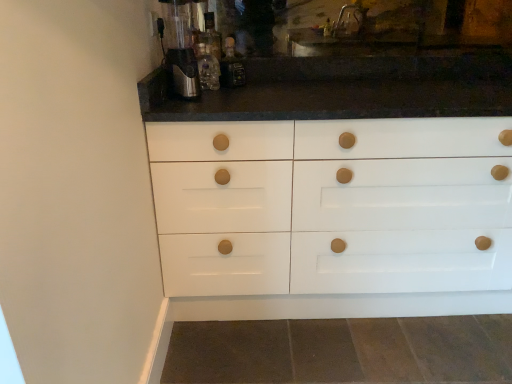
This screenshot has height=384, width=512. I want to click on translucent glass bottle at center, which ranks as the second bottle in left-to-right order, so click(231, 66).

Where is `satin silver coffee machine at upper left`? The image size is (512, 384). satin silver coffee machine at upper left is located at coordinates (181, 47).

Considering the relative sizes of satin silver coffee machine at upper left and translucent glass bottle at upper center, positioned as the first bottle in left-to-right order, in the image provided, is satin silver coffee machine at upper left thinner than translucent glass bottle at upper center, positioned as the first bottle in left-to-right order,?

In fact, satin silver coffee machine at upper left might be wider than translucent glass bottle at upper center, positioned as the first bottle in left-to-right order.

Based on the photo, does satin silver coffee machine at upper left turn towards translucent glass bottle at upper center, positioned as the first bottle in left-to-right order?

No, satin silver coffee machine at upper left is not aimed at translucent glass bottle at upper center, positioned as the first bottle in left-to-right order.

Which of these two, satin silver coffee machine at upper left or translucent glass bottle at upper center, positioned as the first bottle in left-to-right order, stands shorter?

translucent glass bottle at upper center, positioned as the first bottle in left-to-right order.

Is translucent glass bottle at center, which ranks as the second bottle in left-to-right order, to the right of translucent glass bottle at upper center, the 2th bottle from the right, from the viewer's perspective?

Yes.

Between translucent glass bottle at center, which ranks as the second bottle in left-to-right order, and translucent glass bottle at upper center, positioned as the first bottle in left-to-right order, which one has larger width?

With larger width is translucent glass bottle at upper center, positioned as the first bottle in left-to-right order.

In the image, is translucent glass bottle at center, which is counted as the first bottle, starting from the right, positioned in front of or behind translucent glass bottle at upper center, positioned as the first bottle in left-to-right order?

Clearly, translucent glass bottle at center, which is counted as the first bottle, starting from the right, is behind translucent glass bottle at upper center, positioned as the first bottle in left-to-right order.

Which point is more distant from viewer, (214, 68) or (177, 59)?

The point (214, 68) is farther from the camera.

Identify the location of coffee machine on the left of translucent glass bottle at upper center, positioned as the first bottle in left-to-right order. The height and width of the screenshot is (384, 512). (181, 47).

Is translucent glass bottle at upper center, positioned as the first bottle in left-to-right order, outside of satin silver coffee machine at upper left?

Yes, translucent glass bottle at upper center, positioned as the first bottle in left-to-right order, is located beyond the bounds of satin silver coffee machine at upper left.

Who is taller, translucent glass bottle at upper center, the 2th bottle from the right, or satin silver coffee machine at upper left?

With more height is satin silver coffee machine at upper left.

From the image's perspective, which is below, translucent glass bottle at center, which ranks as the second bottle in left-to-right order, or satin silver coffee machine at upper left?

satin silver coffee machine at upper left is shown below in the image.

From the picture: Which object is further away from the camera taking this photo, translucent glass bottle at center, which ranks as the second bottle in left-to-right order, or satin silver coffee machine at upper left?

translucent glass bottle at center, which ranks as the second bottle in left-to-right order, is more distant.

Locate an element on the screen. The width and height of the screenshot is (512, 384). coffee machine lying in front of the translucent glass bottle at center, which is counted as the first bottle, starting from the right is located at coordinates (181, 47).

Considering the relative sizes of satin silver coffee machine at upper left and translucent glass bottle at center, which ranks as the second bottle in left-to-right order, in the image provided, is satin silver coffee machine at upper left smaller than translucent glass bottle at center, which ranks as the second bottle in left-to-right order,?

No.

Which object is positioned more to the right, satin silver coffee machine at upper left or translucent glass bottle at center, which is counted as the first bottle, starting from the right?

translucent glass bottle at center, which is counted as the first bottle, starting from the right.

From a real-world perspective, who is located higher, satin silver coffee machine at upper left or translucent glass bottle at center, which ranks as the second bottle in left-to-right order?

From a 3D spatial view, satin silver coffee machine at upper left is above.

Considering the positions of objects translucent glass bottle at upper center, positioned as the first bottle in left-to-right order, and translucent glass bottle at center, which ranks as the second bottle in left-to-right order, in the image provided, who is more to the left, translucent glass bottle at upper center, positioned as the first bottle in left-to-right order, or translucent glass bottle at center, which ranks as the second bottle in left-to-right order,?

translucent glass bottle at upper center, positioned as the first bottle in left-to-right order.

How many degrees apart are the facing directions of translucent glass bottle at upper center, the 2th bottle from the right, and translucent glass bottle at center, which is counted as the first bottle, starting from the right?

They differ by 2.45 degrees in their facing directions.

From the image's perspective, which is below, translucent glass bottle at upper center, positioned as the first bottle in left-to-right order, or translucent glass bottle at center, which is counted as the first bottle, starting from the right?

translucent glass bottle at upper center, positioned as the first bottle in left-to-right order.

Where is `coffee machine above the translucent glass bottle at upper center, positioned as the first bottle in left-to-right order (from the image's perspective)`? coffee machine above the translucent glass bottle at upper center, positioned as the first bottle in left-to-right order (from the image's perspective) is located at coordinates (181, 47).

Locate an element on the screen. This screenshot has height=384, width=512. bottle on the right of translucent glass bottle at upper center, the 2th bottle from the right is located at coordinates 231,66.

Looking at the image, which one is located further to translucent glass bottle at center, which ranks as the second bottle in left-to-right order, translucent glass bottle at upper center, the 2th bottle from the right, or satin silver coffee machine at upper left?

Based on the image, satin silver coffee machine at upper left appears to be further to translucent glass bottle at center, which ranks as the second bottle in left-to-right order.

Based on their spatial positions, is satin silver coffee machine at upper left or translucent glass bottle at center, which is counted as the first bottle, starting from the right, further from translucent glass bottle at upper center, the 2th bottle from the right?

satin silver coffee machine at upper left lies further to translucent glass bottle at upper center, the 2th bottle from the right, than the other object.

Estimate the real-world distances between objects in this image. Which object is closer to translucent glass bottle at upper center, positioned as the first bottle in left-to-right order, translucent glass bottle at center, which is counted as the first bottle, starting from the right, or satin silver coffee machine at upper left?

Among the two, translucent glass bottle at center, which is counted as the first bottle, starting from the right, is located nearer to translucent glass bottle at upper center, positioned as the first bottle in left-to-right order.

When comparing their distances from satin silver coffee machine at upper left, does translucent glass bottle at upper center, the 2th bottle from the right, or translucent glass bottle at center, which ranks as the second bottle in left-to-right order, seem closer?

translucent glass bottle at upper center, the 2th bottle from the right, lies closer to satin silver coffee machine at upper left than the other object.

When comparing their distances from satin silver coffee machine at upper left, does translucent glass bottle at center, which is counted as the first bottle, starting from the right, or translucent glass bottle at upper center, positioned as the first bottle in left-to-right order, seem closer?

translucent glass bottle at upper center, positioned as the first bottle in left-to-right order, is closer to satin silver coffee machine at upper left.

From the image, which object appears to be nearer to translucent glass bottle at center, which is counted as the first bottle, starting from the right, satin silver coffee machine at upper left or translucent glass bottle at upper center, the 2th bottle from the right?

translucent glass bottle at upper center, the 2th bottle from the right, is closer to translucent glass bottle at center, which is counted as the first bottle, starting from the right.

This screenshot has width=512, height=384. Identify the location of bottle between satin silver coffee machine at upper left and translucent glass bottle at center, which ranks as the second bottle in left-to-right order, in the front-back direction. (207, 68).